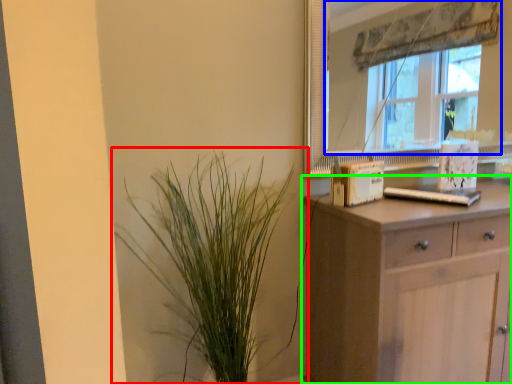
Question: Based on their relative distances, which object is farther from houseplant (highlighted by a red box)? Choose from window (highlighted by a blue box) and chest of drawers (highlighted by a green box).

Choices:
 (A) window
 (B) chest of drawers

Answer: (A)